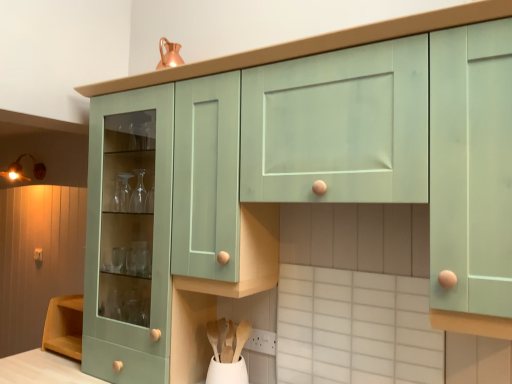
Question: Does white plastic power plugs and sockets at lower center have a greater width compared to matte wooden knob at lower left?

Choices:
 (A) no
 (B) yes

Answer: (A)

Question: Can you confirm if white plastic power plugs and sockets at lower center is positioned to the right of matte wooden knob at lower left?

Choices:
 (A) no
 (B) yes

Answer: (B)

Question: Is white plastic power plugs and sockets at lower center thinner than matte wooden knob at lower left?

Choices:
 (A) yes
 (B) no

Answer: (A)

Question: Considering the relative sizes of white plastic power plugs and sockets at lower center and matte wooden knob at lower left in the image provided, is white plastic power plugs and sockets at lower center taller than matte wooden knob at lower left?

Choices:
 (A) yes
 (B) no

Answer: (B)

Question: From a real-world perspective, is white plastic power plugs and sockets at lower center beneath matte wooden knob at lower left?

Choices:
 (A) yes
 (B) no

Answer: (A)

Question: Is white plastic power plugs and sockets at lower center further to the viewer compared to matte wooden knob at lower left?

Choices:
 (A) no
 (B) yes

Answer: (A)

Question: Is wooden at lower center, which is the second spoon in right-to-left order, a part of white plastic power plugs and sockets at lower center?

Choices:
 (A) no
 (B) yes

Answer: (A)

Question: Considering the relative sizes of white plastic power plugs and sockets at lower center and wooden at lower center, the first spoon when ordered from left to right, in the image provided, is white plastic power plugs and sockets at lower center shorter than wooden at lower center, the first spoon when ordered from left to right,?

Choices:
 (A) yes
 (B) no

Answer: (A)

Question: From the image's perspective, does white plastic power plugs and sockets at lower center appear lower than wooden at lower center, the first spoon when ordered from left to right?

Choices:
 (A) yes
 (B) no

Answer: (B)

Question: Are white plastic power plugs and sockets at lower center and wooden at lower center, which is the second spoon in right-to-left order, beside each other?

Choices:
 (A) no
 (B) yes

Answer: (A)

Question: Is white plastic power plugs and sockets at lower center smaller than wooden at lower center, the first spoon when ordered from left to right?

Choices:
 (A) no
 (B) yes

Answer: (B)

Question: Considering the relative positions of white plastic power plugs and sockets at lower center and wooden at lower center, which is the second spoon in right-to-left order, in the image provided, is white plastic power plugs and sockets at lower center to the left of wooden at lower center, which is the second spoon in right-to-left order, from the viewer's perspective?

Choices:
 (A) yes
 (B) no

Answer: (B)

Question: Can you confirm if matte wooden knob at lower left is taller than mint green cabinet at center?

Choices:
 (A) yes
 (B) no

Answer: (B)